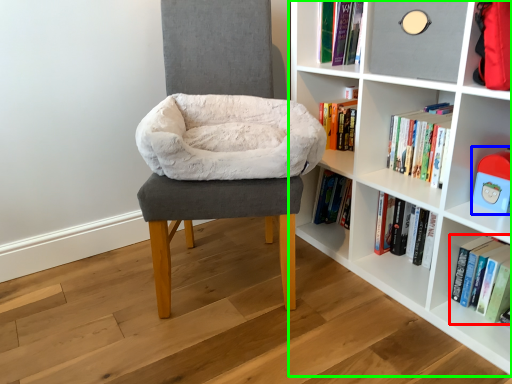
Question: Considering the real-world distances, which object is closest to book (highlighted by a red box)? toy (highlighted by a blue box) or shelf (highlighted by a green box).

Choices:
 (A) toy
 (B) shelf

Answer: (A)